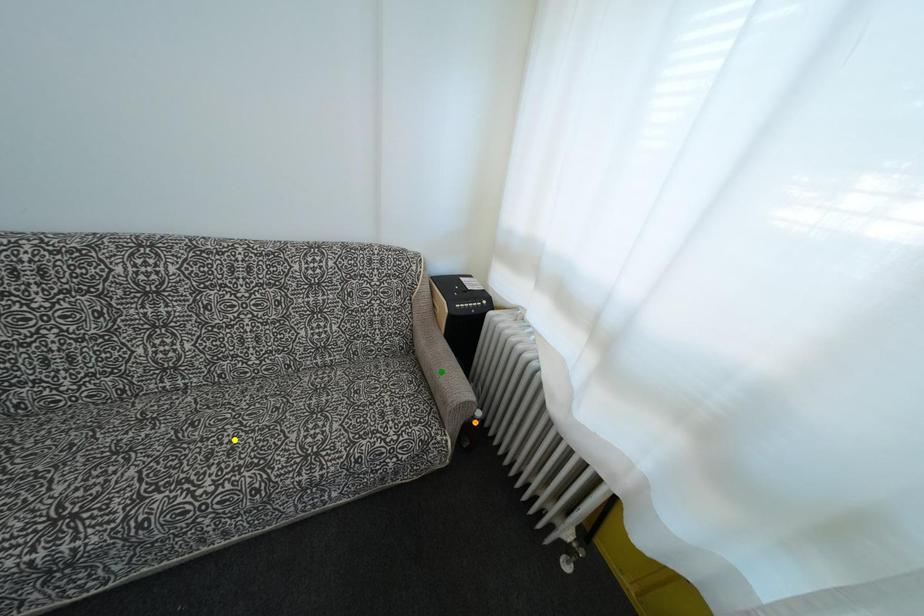
Order these from nearest to farthest:
1. green point
2. orange point
3. yellow point

yellow point, orange point, green point